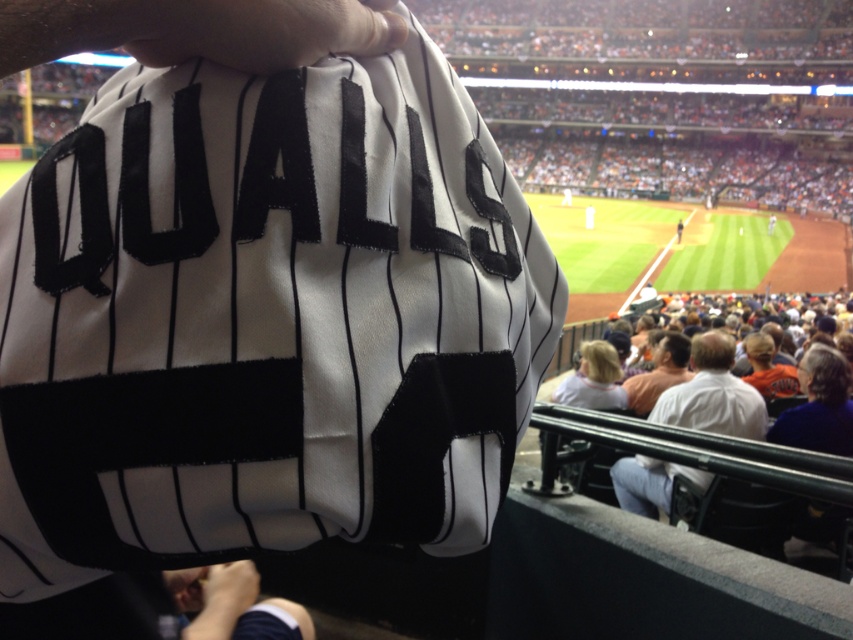
You are a photographer at the baseball stadium and want to capture a photo that includes both the white fabric shirt at lower right and the orange jersey at center. Which object should you zoom in on to ensure both are visible in the frame without cropping?

You should zoom in on the orange jersey at center because it occupies more space than the white fabric shirt at lower right, making it easier to include both in the frame.

You are a photographer positioned at the center of the baseball stadium. You see the white matte baseball uniform at center and the dark blue fabric at lower left. Which object is nearer to you?

The white matte baseball uniform at center is closer to the viewer than the dark blue fabric at lower left.

You are a photographer standing at the edge of the baseball field. You want to take a photo of the white fabric shirt at lower right and the orange jersey at center. Can you fit both in your camera frame if your camera has a minimum required distance of 1.5 meters between subjects to capture them clearly?

Yes, the distance between the white fabric shirt at lower right and orange jersey at center is 1.76 meters, which exceeds the camera requirement of 1.5 meters. Both subjects can be captured clearly in the photo.